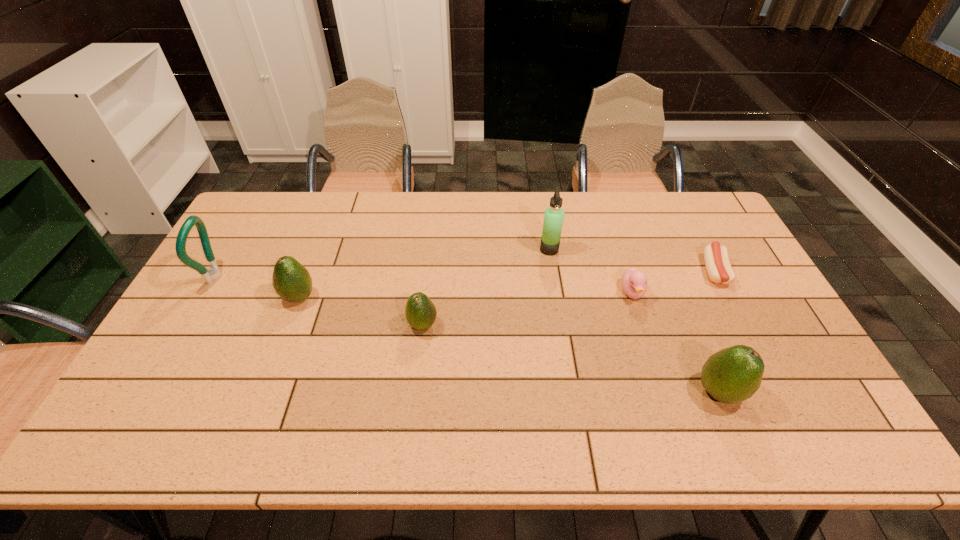
You are a GUI agent. You are given a task and a screenshot of the screen. Output one action in this format:
    pyautogui.click(x=<x>, y=<y>)
    Task: Click on the free location that satisfies the following two spatial constraints: 1. on the back side of the thermos bottle; 2. on the right side of the farthest avocado
    
    Given the screenshot: What is the action you would take?
    pyautogui.click(x=317, y=249)

You are a GUI agent. You are given a task and a screenshot of the screen. Output one action in this format:
    pyautogui.click(x=<x>, y=<y>)
    Task: Click on the vacant area in the image that satisfies the following two spatial constraints: 1. on the front side of the fourth object from left to right; 2. at the jaws of the leftmost object
    
    Given the screenshot: What is the action you would take?
    pyautogui.click(x=554, y=276)

You are a GUI agent. You are given a task and a screenshot of the screen. Output one action in this format:
    pyautogui.click(x=<x>, y=<y>)
    Task: Click on the vacant space that satisfies the following two spatial constraints: 1. on the back side of the shortest object; 2. on the left side of the leftmost avocado
    The width and height of the screenshot is (960, 540).
    Given the screenshot: What is the action you would take?
    pyautogui.click(x=309, y=271)

Locate an element on the screen. This screenshot has width=960, height=540. free space that satisfies the following two spatial constraints: 1. at the jaws of the leftmost object; 2. on the left side of the fifth tallest object is located at coordinates (188, 325).

What are the coordinates of `free spot that satisfies the following two spatial constraints: 1. on the back side of the third shortest object; 2. on the left side of the rightmost object` in the screenshot? It's located at (429, 271).

Locate an element on the screen. The width and height of the screenshot is (960, 540). vacant point that satisfies the following two spatial constraints: 1. at the jaws of the bottle opener; 2. on the back side of the nearest object is located at coordinates (150, 392).